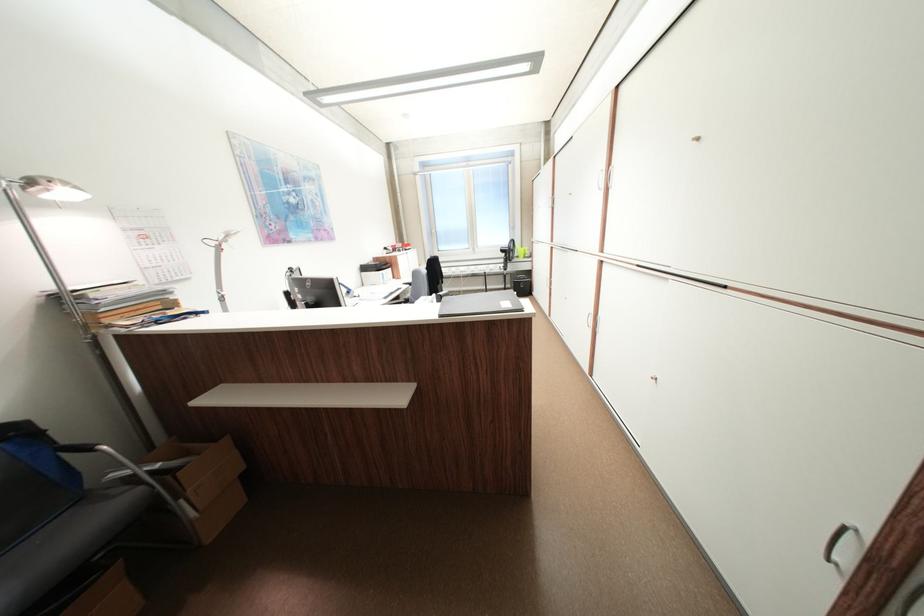
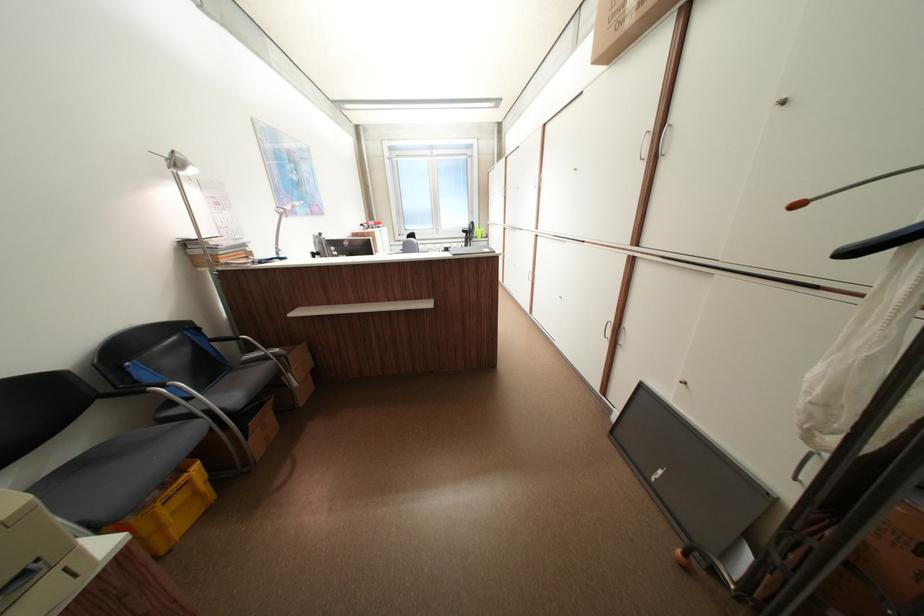
What movement of the cameraman would produce the second image?

The movement direction of the cameraman is left, backward.